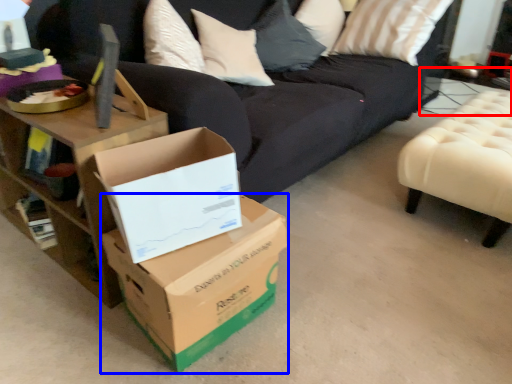
Question: Which object appears closest to the camera in this image, side table (highlighted by a red box) or box (highlighted by a blue box)?

Choices:
 (A) side table
 (B) box

Answer: (B)